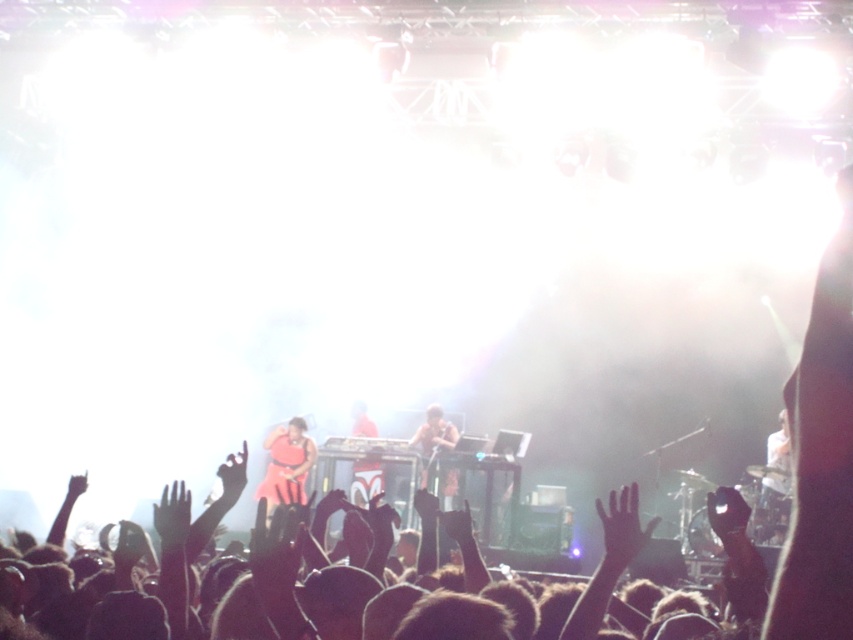
From the picture: You are a photographer at the concert. You want to capture a photo where both the transparent glass hand at center and the shiny brown microphone at center are clearly visible. Which object should you focus on to ensure the smaller one is in sharp focus?

The transparent glass hand at center is smaller than the shiny brown microphone at center, so you should focus on the transparent glass hand at center to ensure it is in sharp focus.

You are a photographer at the concert. You want to take a photo focusing on the matte pink dress at center and the black matte hand at lower left. Which object should you zoom in on to capture more details without moving the camera?

The matte pink dress at center is closer to the photographer, so zooming in on it will allow capturing more details without moving the camera.

You are standing in the crowd at the concert and want to move towards the stage. There are two points marked on the stage floor, one at coordinates point (608, 540) and another at point (448, 486). Which point should you aim for if you want to reach the one that is closer to you?

Point (608, 540) is closer to the viewer, so you should aim for point (608, 540).